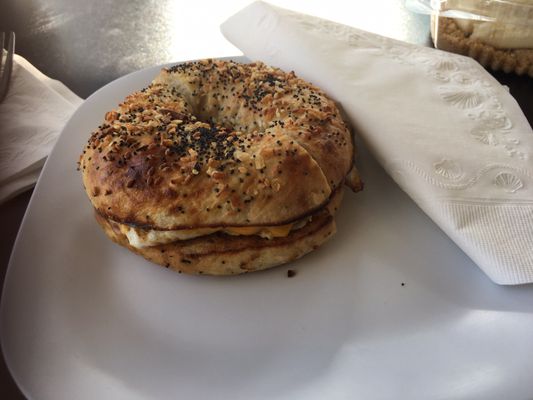
You are a GUI agent. You are given a task and a screenshot of the screen. Output one action in this format:
    pyautogui.click(x=<x>, y=<y>)
    Task: Click on the fork
    
    Given the screenshot: What is the action you would take?
    pyautogui.click(x=9, y=62)